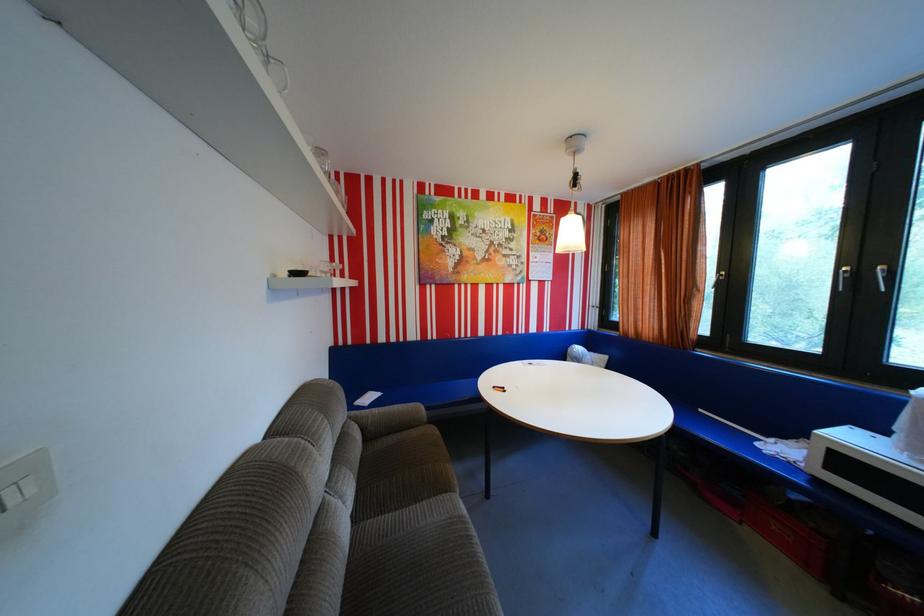
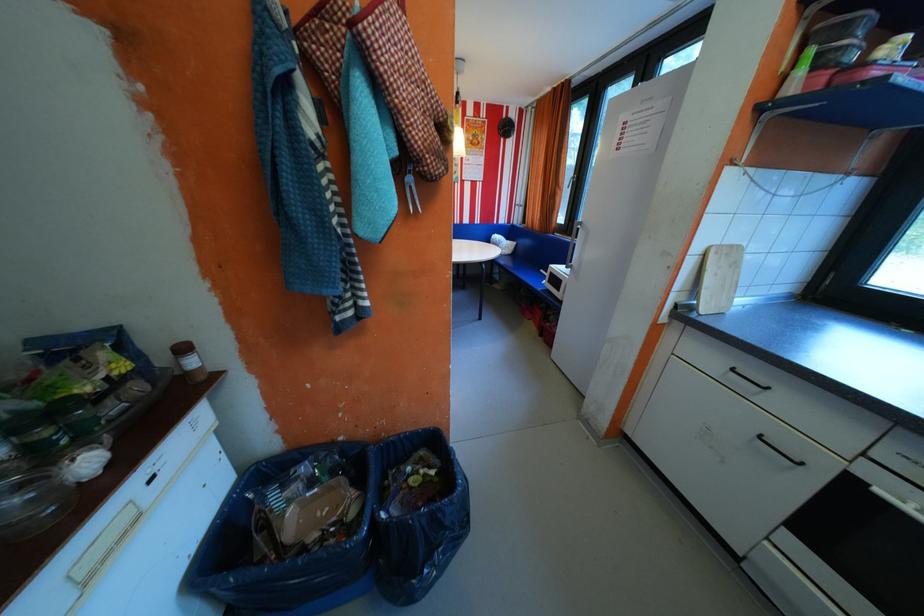
What movement of the cameraman would produce the second image?

The movement direction of the cameraman is right, backward.